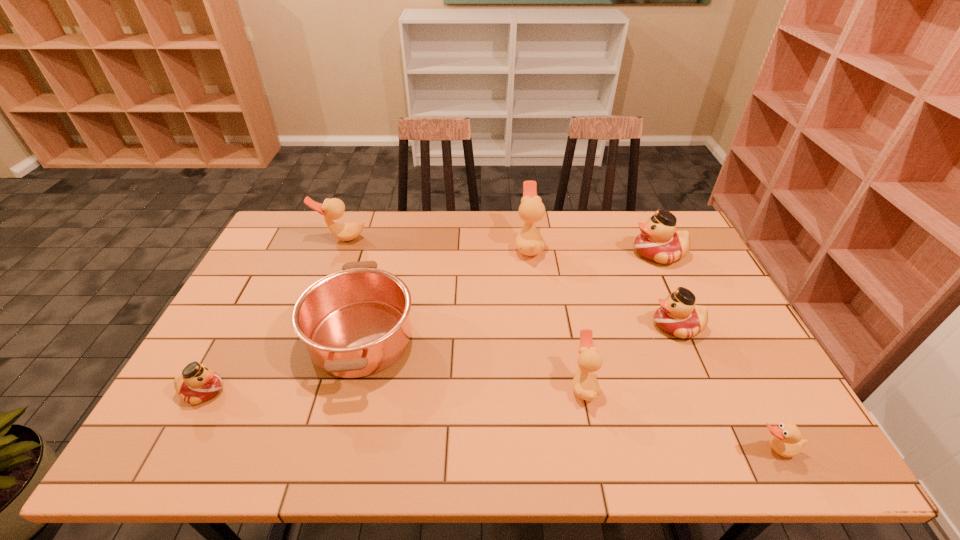
Find the location of a particular element. the smallest red duck is located at coordinates (197, 384).

Where is `the leftmost duck`? This screenshot has width=960, height=540. the leftmost duck is located at coordinates (197, 384).

The width and height of the screenshot is (960, 540). In order to click on the smallest tan duck in this screenshot , I will do `click(787, 441)`.

Where is `the nearest tan duck`? The image size is (960, 540). the nearest tan duck is located at coordinates (787, 441).

This screenshot has width=960, height=540. Identify the location of vacant point located on the beak of the third tan duck from right to left. (413, 246).

This screenshot has width=960, height=540. I want to click on vacant area located on the beak of the third tan duck from right to left, so click(x=500, y=246).

Locate an element on the screen. This screenshot has width=960, height=540. vacant space located 0.180m on the beak of the third tan duck from right to left is located at coordinates (462, 246).

Locate an element on the screen. Image resolution: width=960 pixels, height=540 pixels. free space located on the face of the farthest red duck is located at coordinates (527, 254).

Image resolution: width=960 pixels, height=540 pixels. Find the location of `free space located on the face of the farthest red duck`. free space located on the face of the farthest red duck is located at coordinates (551, 254).

Find the location of `vacant space located 0.200m on the face of the farthest red duck`. vacant space located 0.200m on the face of the farthest red duck is located at coordinates (572, 254).